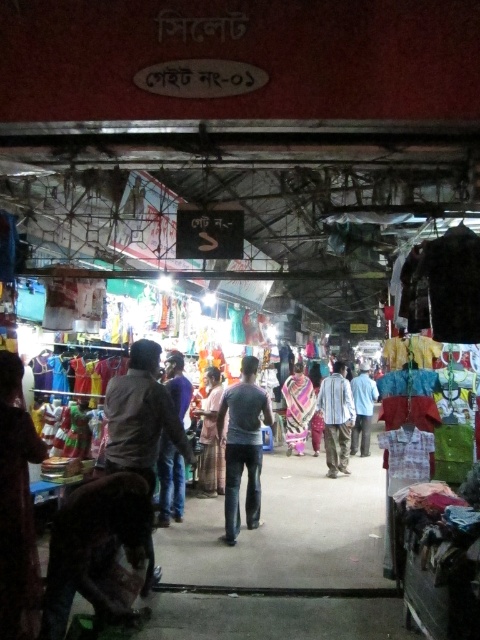
Which is in front, point (180, 499) or point (286, 384)?

Positioned in front is point (180, 499).

Is purple cotton shirt at center shorter than multicolored woven cloth at center?

Yes, purple cotton shirt at center is shorter than multicolored woven cloth at center.

Who is more forward, (177, 401) or (296, 376)?

Result: Positioned in front is point (177, 401).

The image size is (480, 640). I want to click on purple cotton shirt at center, so click(169, 483).

At what (x,y) coordinates should I click in order to perform the action: click on dark gray cotton shirt at center. Please return your answer as a coordinate pair (x, y). Image resolution: width=480 pixels, height=640 pixels. Looking at the image, I should click on (242, 445).

Can you confirm if dark gray cotton shirt at center is positioned to the left of purple cotton shirt at center?

In fact, dark gray cotton shirt at center is to the right of purple cotton shirt at center.

Which is behind, point (264, 396) or point (187, 381)?

The point (187, 381) is behind.

The height and width of the screenshot is (640, 480). Find the location of `dark gray cotton shirt at center`. dark gray cotton shirt at center is located at coordinates (242, 445).

Who is shorter, multicolored woven cloth at center or light blue shirt at center?

Standing shorter between the two is light blue shirt at center.

Is point (300, 444) closer to camera compared to point (362, 369)?

Yes, point (300, 444) is closer to viewer.

You are a GUI agent. You are given a task and a screenshot of the screen. Output one action in this format:
    pyautogui.click(x=<x>, y=<y>)
    Task: Click on the multicolored woven cloth at center
    The height and width of the screenshot is (640, 480).
    Given the screenshot: What is the action you would take?
    pyautogui.click(x=298, y=408)